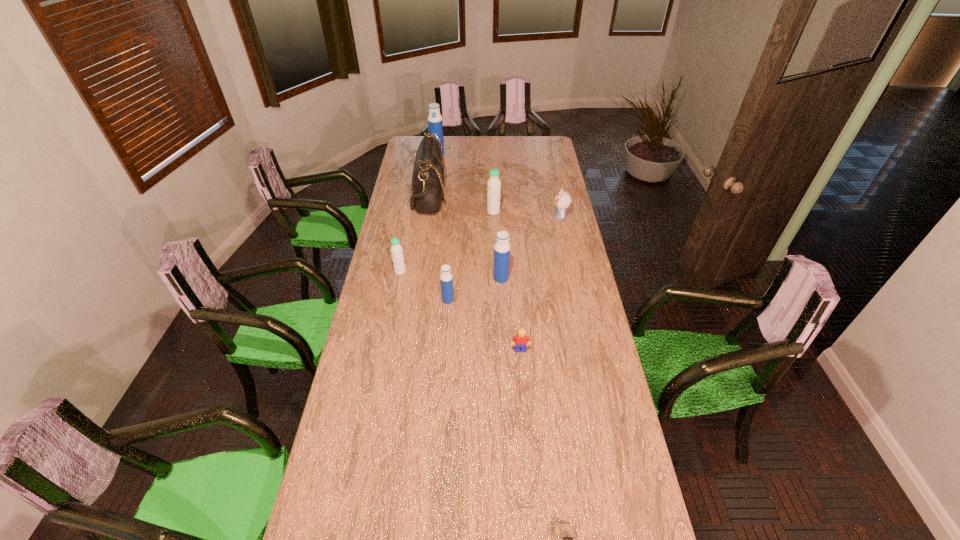
This screenshot has height=540, width=960. Identify the location of the farthest object. (435, 125).

The height and width of the screenshot is (540, 960). What are the coordinates of `the farthest blue water bottle` in the screenshot? It's located at (435, 125).

Identify the location of handbag. This screenshot has height=540, width=960. (428, 181).

The image size is (960, 540). In order to click on the rightmost blue water bottle in this screenshot , I will do `click(501, 263)`.

Find the location of a particular element. This screenshot has height=540, width=960. the second biggest blue water bottle is located at coordinates (501, 263).

Where is `the right white water bottle`? the right white water bottle is located at coordinates (494, 184).

Image resolution: width=960 pixels, height=540 pixels. I want to click on the fourth nearest water bottle, so click(x=494, y=184).

Image resolution: width=960 pixels, height=540 pixels. Find the location of `the nearer white water bottle`. the nearer white water bottle is located at coordinates (396, 249).

What are the coordinates of `the smaller white water bottle` in the screenshot? It's located at (396, 249).

Where is `the smallest blue water bottle`? Image resolution: width=960 pixels, height=540 pixels. the smallest blue water bottle is located at coordinates (446, 278).